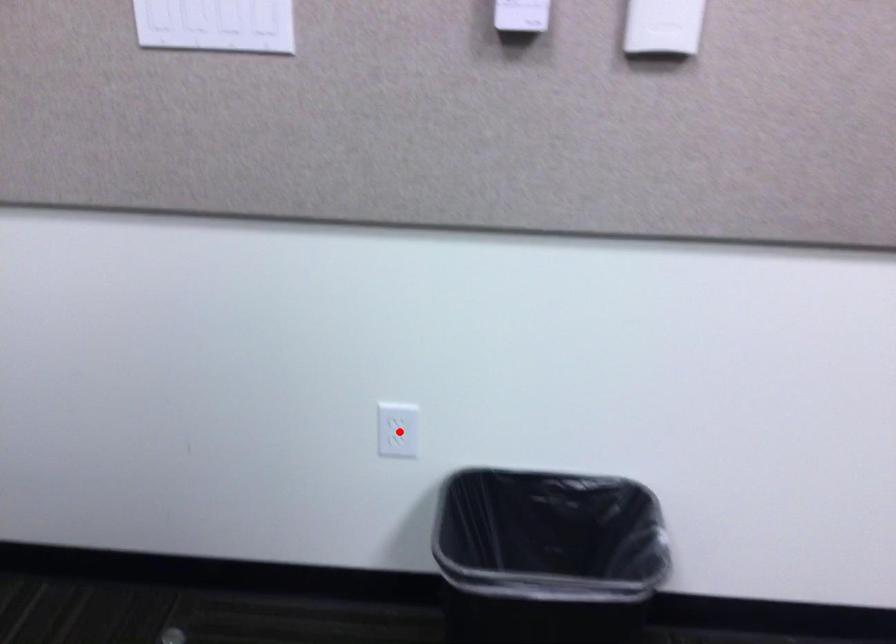
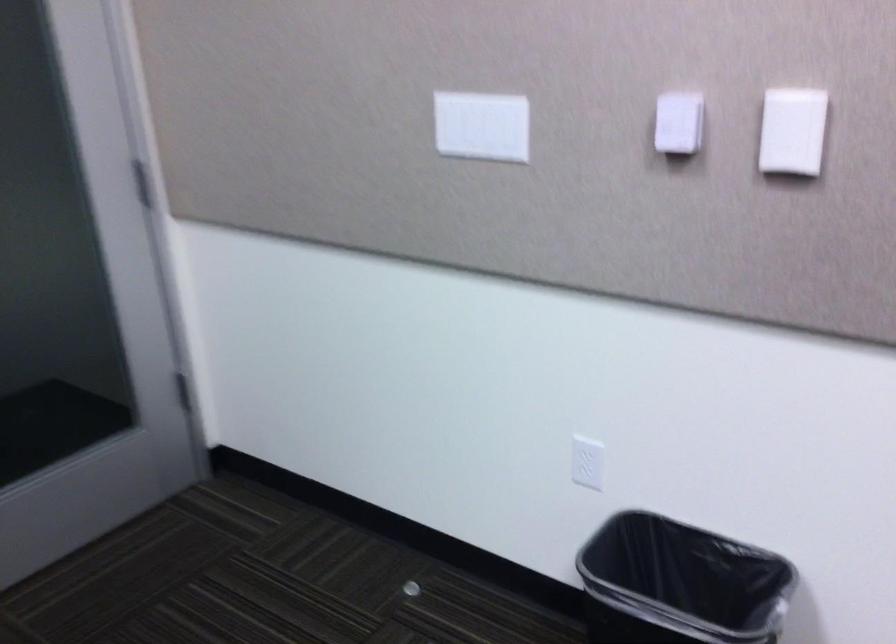
Question: I am providing you with two images of the same scene from different viewpoints. A red point is marked on the first image. At the location where the point appears in image 1, is it still visible in image 2?

Choices:
 (A) Yes
 (B) No

Answer: (A)